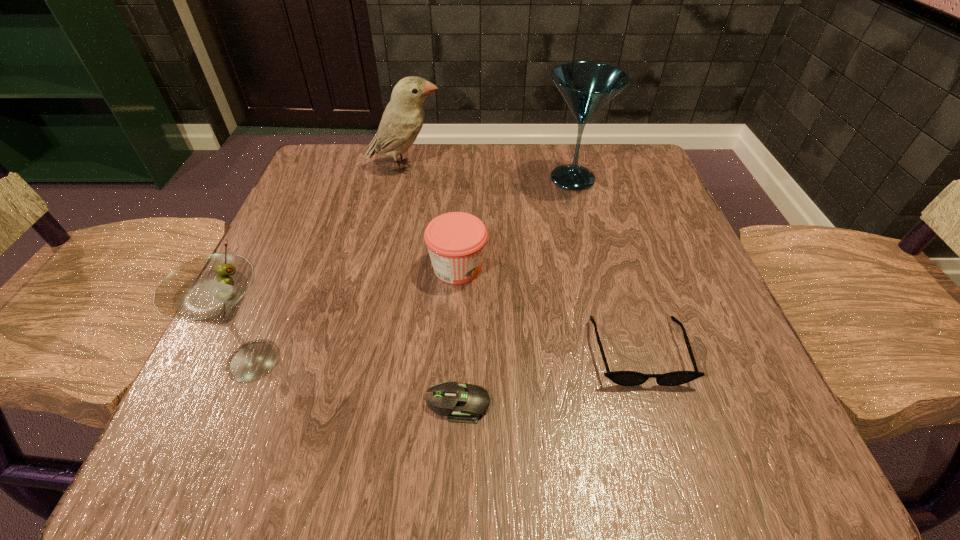
Where is `vacant point at the far right corner`? This screenshot has height=540, width=960. vacant point at the far right corner is located at coordinates (587, 153).

Locate an element on the screen. The width and height of the screenshot is (960, 540). vacant space that is in between the bird and the shorter martini is located at coordinates (329, 263).

This screenshot has width=960, height=540. Identify the location of empty location between the leftmost object and the fourth nearest object. (355, 314).

At what (x,y) coordinates should I click in order to perform the action: click on vacant point located between the left martini and the shortest object. Please return your answer as a coordinate pair (x, y). Looking at the image, I should click on (356, 381).

You are a GUI agent. You are given a task and a screenshot of the screen. Output one action in this format:
    pyautogui.click(x=<x>, y=<y>)
    Task: Click on the vacant area between the bird and the fifth tallest object
    The width and height of the screenshot is (960, 540).
    Given the screenshot: What is the action you would take?
    pyautogui.click(x=522, y=259)

The width and height of the screenshot is (960, 540). What are the coordinates of `vacant area between the third shortest object and the computer mouse` in the screenshot? It's located at (458, 335).

Where is `vacant region between the shortest object and the second shortest object`? The height and width of the screenshot is (540, 960). vacant region between the shortest object and the second shortest object is located at coordinates (548, 377).

Where is `vacant area between the shorter martini and the computer mouse`? This screenshot has width=960, height=540. vacant area between the shorter martini and the computer mouse is located at coordinates (356, 381).

I want to click on unoccupied area between the bird and the nearer martini, so click(329, 263).

This screenshot has height=540, width=960. Find the location of `vacant point located between the shortest object and the third shortest object`. vacant point located between the shortest object and the third shortest object is located at coordinates (458, 335).